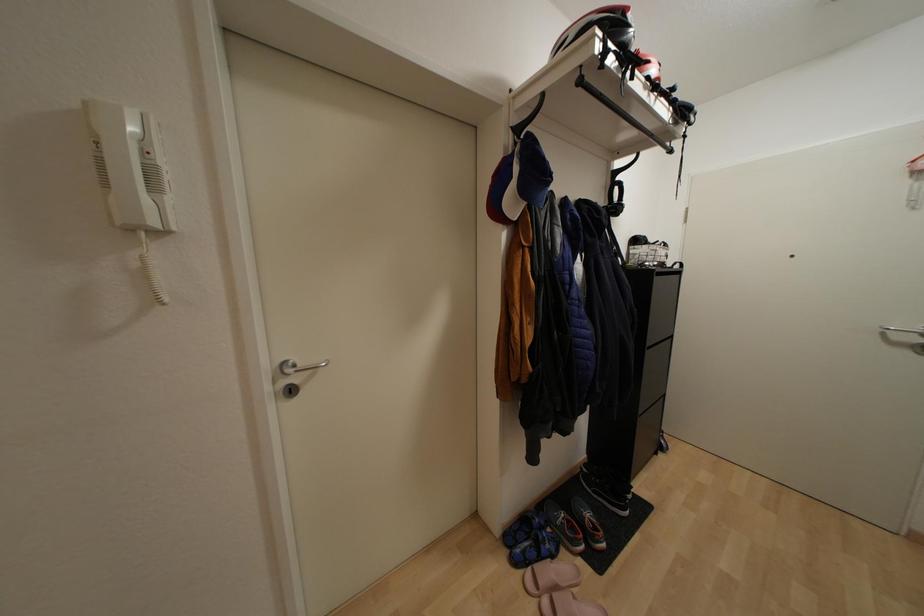
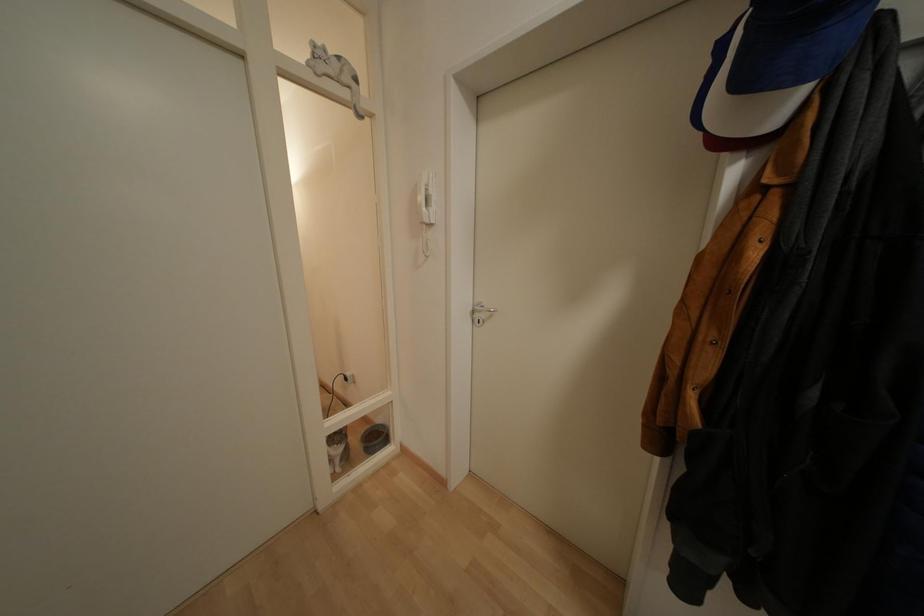
Question: The images are taken continuously from a first-person perspective. In which direction is your viewpoint rotating?

Choices:
 (A) Left
 (B) Right
 (C) Up
 (D) Down

Answer: (A)